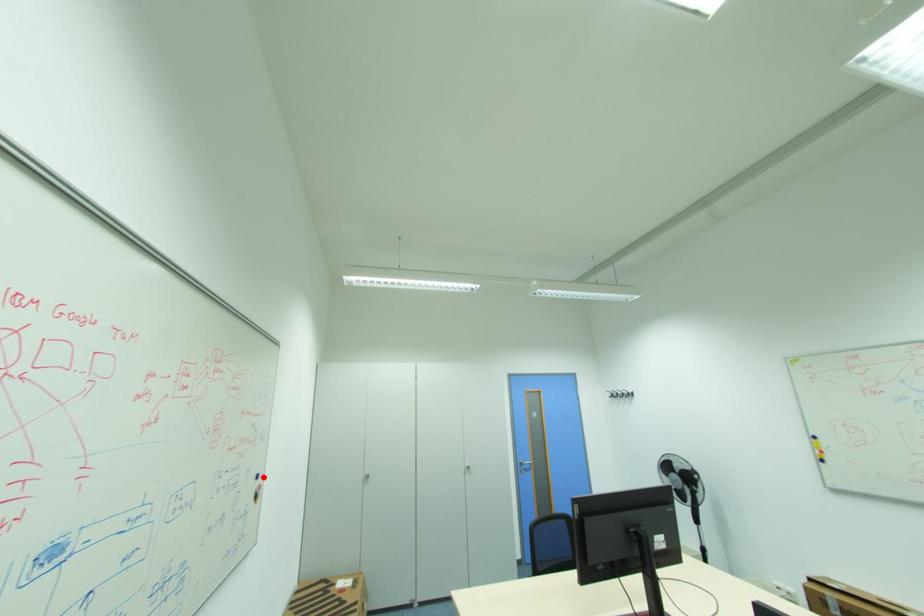
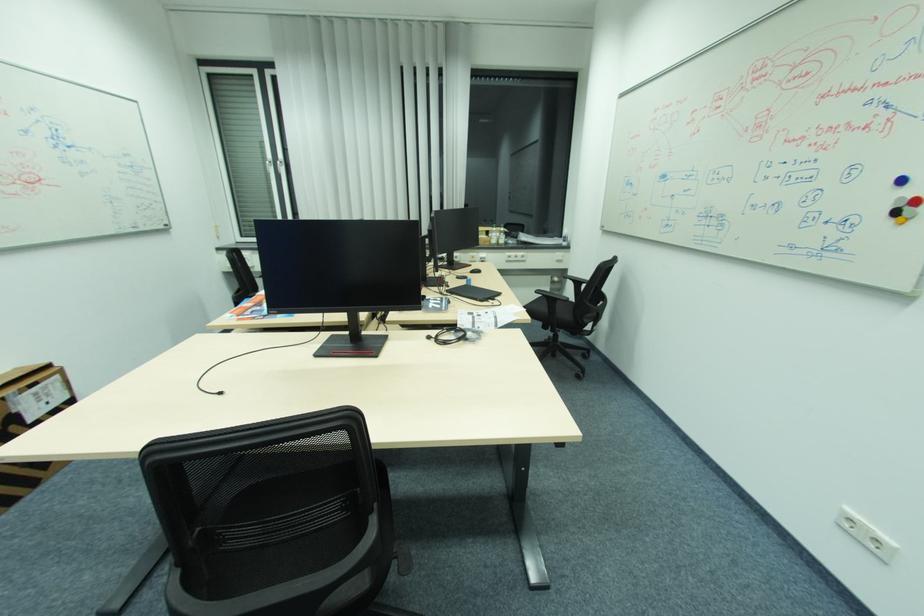
The point at the highlighted location is marked in the first image. Where is the corresponding point in the second image?

(908, 180)